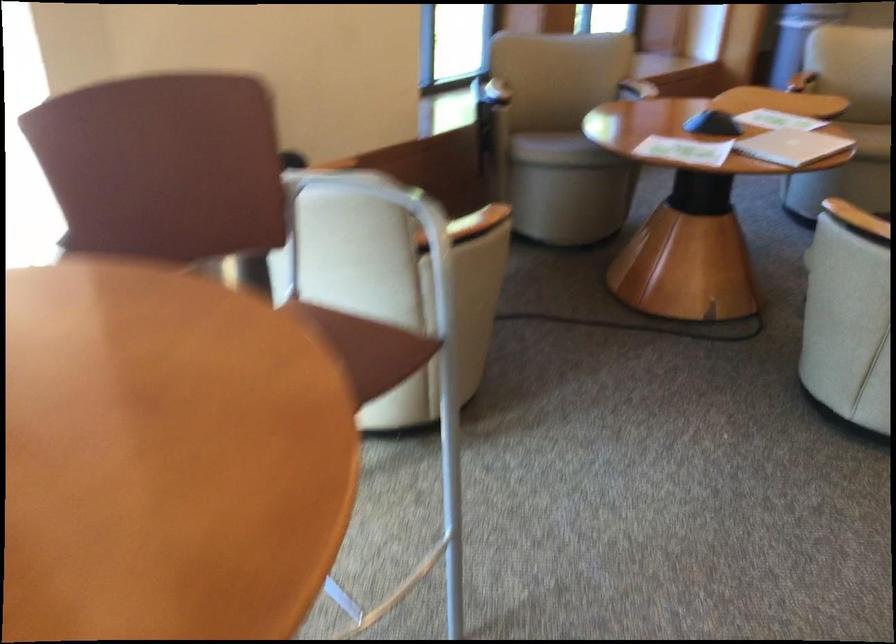
What do you see at coordinates (791, 147) in the screenshot? The height and width of the screenshot is (644, 896). I see `the closed silver laptop` at bounding box center [791, 147].